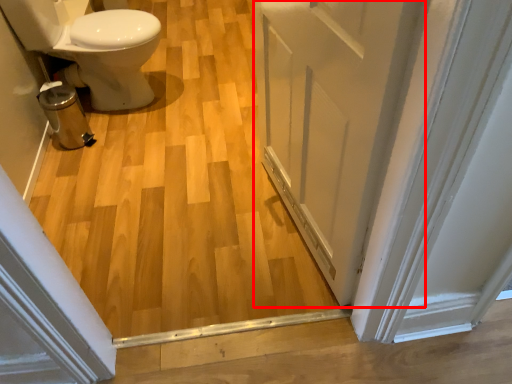
Question: From the image, what is the correct spatial relationship of door (annotated by the red box) in relation to bidet?

Choices:
 (A) right
 (B) left

Answer: (A)